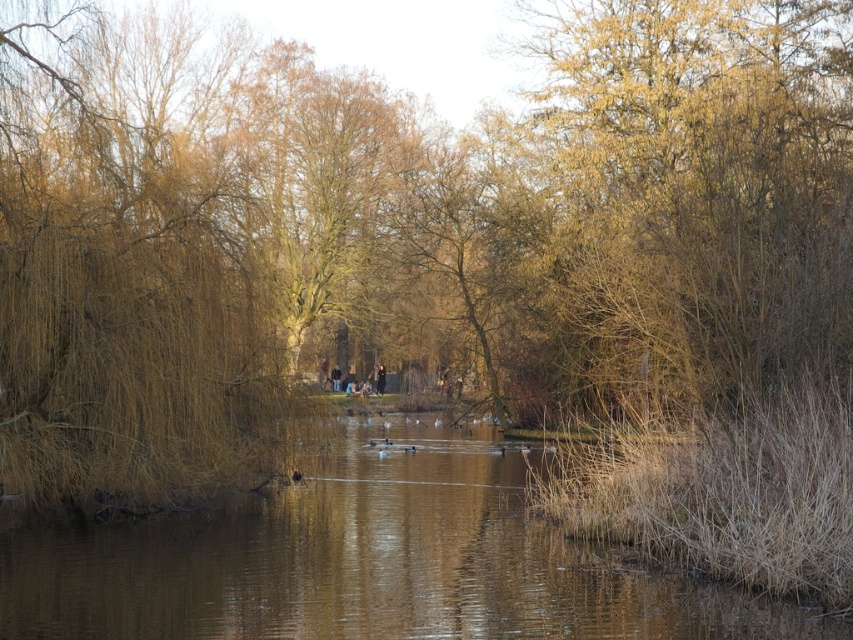
You are standing at the edge of the waterway and see two points marked in the scene. The first point is at coordinates point [57,68] and the second is at point [503,460]. Which point is closer to you?

Point [57,68] is in front of point [503,460], so the first point is closer to you.

You are standing on a path near the waterway and want to take a photo of both the brown grassy willow at left and the brown grassy lake at center. Which direction should you face to include both in your frame?

You should face towards the right to include both the brown grassy willow at left and the brown grassy lake at center in your frame, as the brown grassy willow at left is positioned to the left of the brown grassy lake at center.

Looking at this image, you are a bird looking for a place to perch. You see a brown grassy willow at left and a brown grassy lake at center. Which one is taller?

The brown grassy willow at left is much taller than the brown grassy lake at center, so you should choose the brown grassy willow at left to perch.